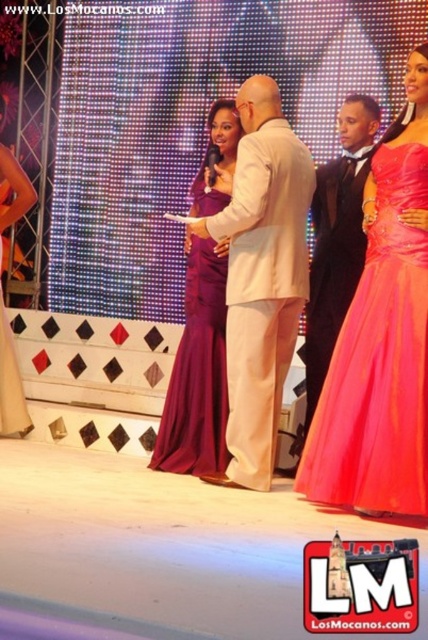
Question: Can you confirm if purple satin dress at center is positioned to the left of burgundy satin dress at center?

Choices:
 (A) no
 (B) yes

Answer: (A)

Question: Among these objects, which one is farthest from the camera?

Choices:
 (A) shiny orange gown at center
 (B) light beige suit at center
 (C) purple satin dress at center
 (D) matte purple dress at lower left

Answer: (D)

Question: Is light beige suit at center smaller than burgundy satin dress at center?

Choices:
 (A) no
 (B) yes

Answer: (A)

Question: Which of the following is the closest to the observer?

Choices:
 (A) (222, 216)
 (B) (2, 308)
 (C) (395, 348)
 (D) (213, 451)

Answer: (C)

Question: Which object appears farthest from the camera in this image?

Choices:
 (A) matte purple dress at lower left
 (B) burgundy satin dress at center
 (C) shiny orange gown at center
 (D) purple satin dress at center

Answer: (A)

Question: Is purple satin dress at center above burgundy satin dress at center?

Choices:
 (A) no
 (B) yes

Answer: (B)